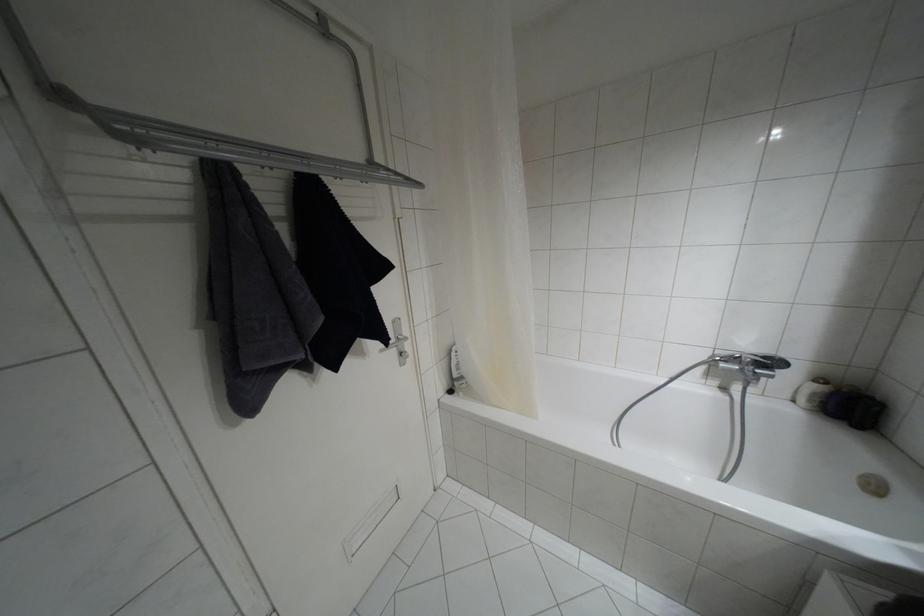
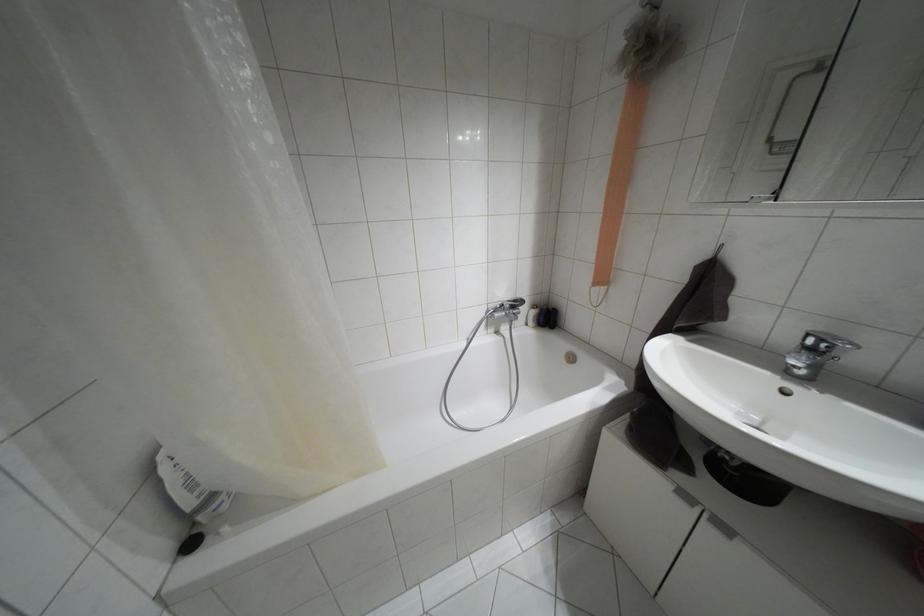
In the second image, find the point that corresponds to point 763,357 in the first image.

(514, 301)